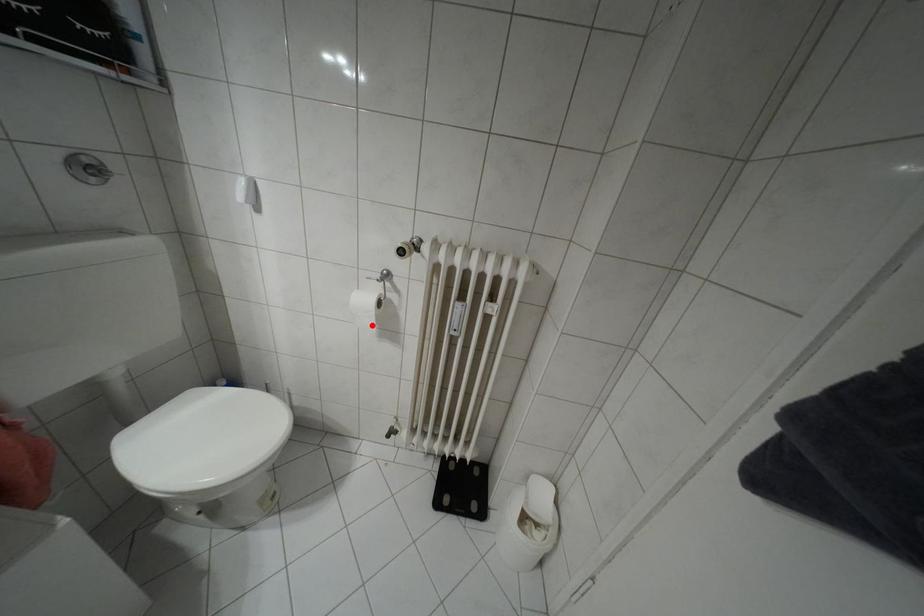
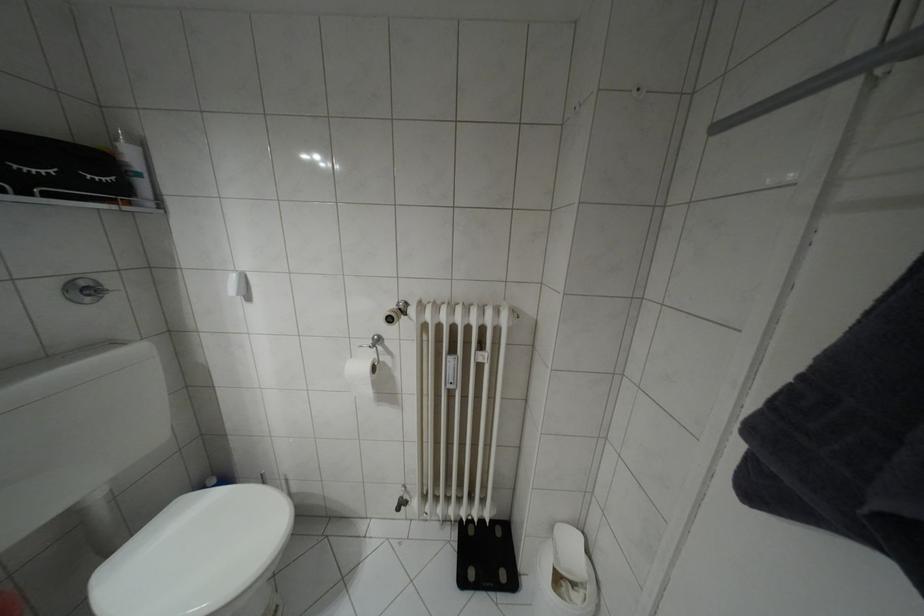
The point at the highlighted location is marked in the first image. Where is the corresponding point in the second image?

(369, 392)